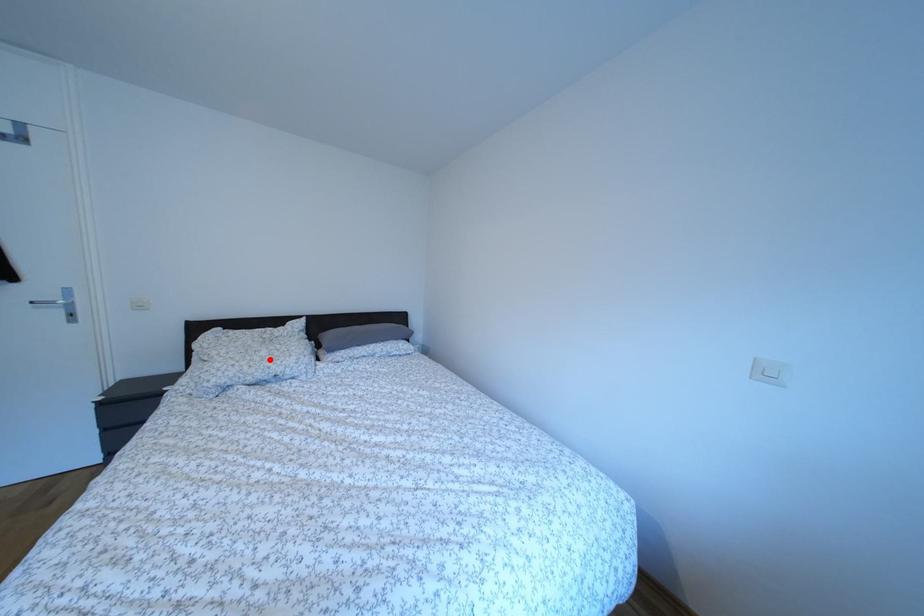
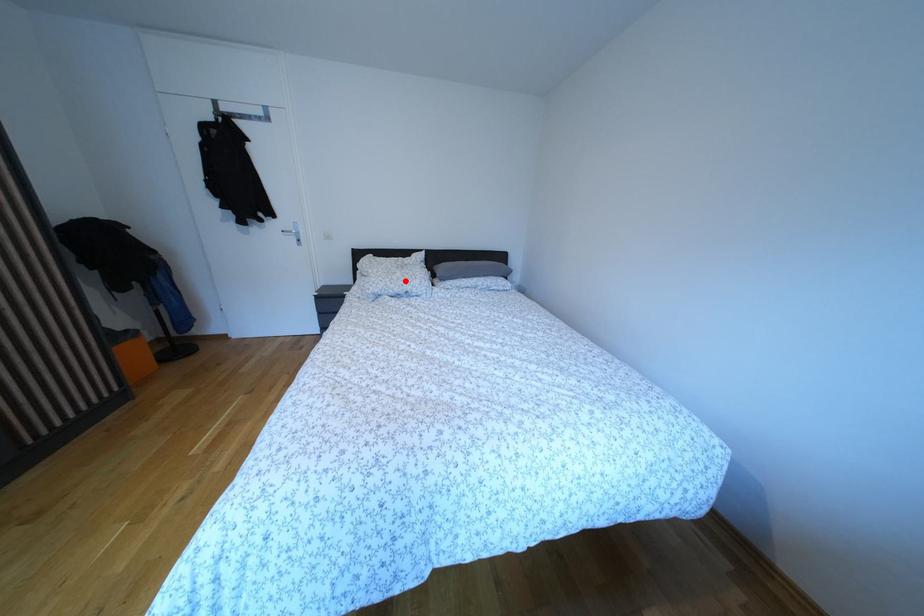
I am providing you with two images of the same scene from different viewpoints. A red point is marked on the first image and another point is marked on the second image. Do the highlighted points in image1 and image2 indicate the same real-world spot?

Yes